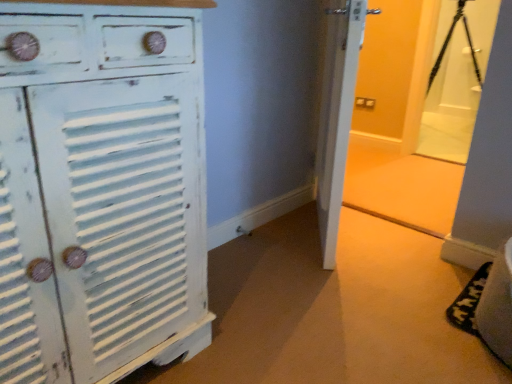
Question: Is point (30, 54) positioned closer to the camera than point (479, 71)?

Choices:
 (A) farther
 (B) closer

Answer: (B)

Question: Looking at their shapes, would you say distressed white cabinet at left is wider or thinner than black matte tripod at upper right?

Choices:
 (A) wide
 (B) thin

Answer: (A)

Question: In terms of height, does distressed white cabinet at left look taller or shorter compared to black matte tripod at upper right?

Choices:
 (A) short
 (B) tall

Answer: (B)

Question: Looking at their shapes, would you say black matte tripod at upper right is wider or thinner than distressed white cabinet at left?

Choices:
 (A) thin
 (B) wide

Answer: (A)

Question: Would you say black matte tripod at upper right is to the left or to the right of distressed white cabinet at left in the picture?

Choices:
 (A) left
 (B) right

Answer: (B)

Question: Is point (479, 81) closer or farther from the camera than point (14, 336)?

Choices:
 (A) closer
 (B) farther

Answer: (B)

Question: In the image, is black matte tripod at upper right positioned in front of or behind distressed white cabinet at left?

Choices:
 (A) behind
 (B) front

Answer: (A)